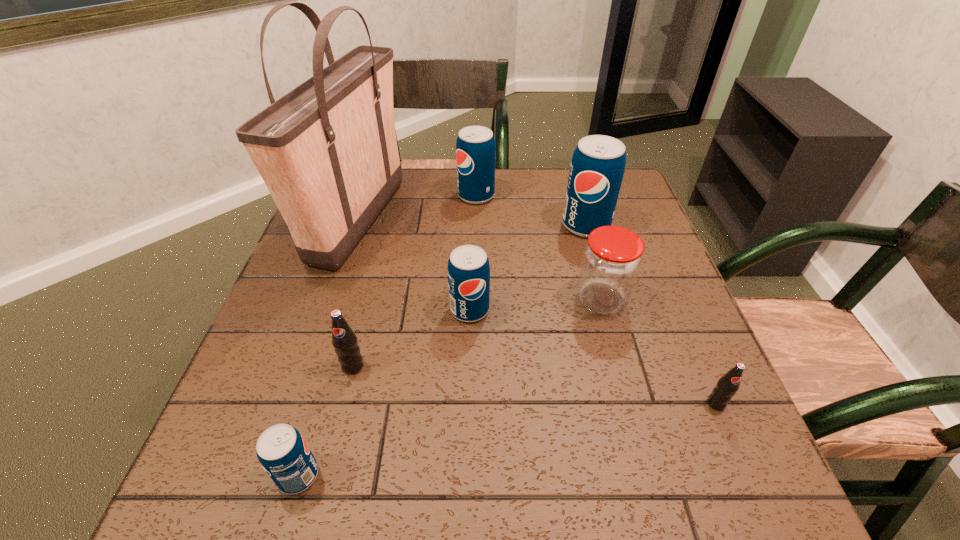
This screenshot has height=540, width=960. Find the location of `the tallest object`. the tallest object is located at coordinates (327, 151).

The width and height of the screenshot is (960, 540). In order to click on the biggest blue pop in this screenshot , I will do `click(597, 168)`.

The image size is (960, 540). I want to click on the tallest pop, so click(597, 168).

At what (x,y) coordinates should I click in order to perform the action: click on the farthest pop. Please return your answer as a coordinate pair (x, y). This screenshot has height=540, width=960. Looking at the image, I should click on (475, 146).

At what (x,y) coordinates should I click in order to perform the action: click on the farthest blue pop. Please return your answer as a coordinate pair (x, y). This screenshot has width=960, height=540. Looking at the image, I should click on (475, 146).

I want to click on red jar, so click(611, 261).

The image size is (960, 540). I want to click on the second smallest blue pop, so click(468, 270).

Identify the location of the second nearest blue pop. This screenshot has width=960, height=540. (468, 270).

Locate an element on the screen. the left black pop is located at coordinates (344, 340).

This screenshot has width=960, height=540. I want to click on the farther black pop, so click(344, 340).